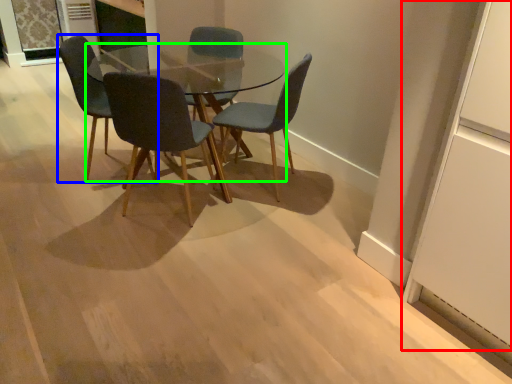
Question: Estimate the real-world distances between objects in this image. Which object is farther from glass door (highlighted by a red box), chair (highlighted by a blue box) or coffee table (highlighted by a green box)?

Choices:
 (A) chair
 (B) coffee table

Answer: (B)